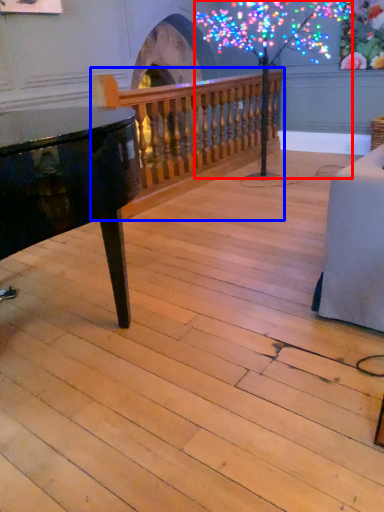
Question: Which of the following is the closest to the observer, tree (highlighted by a red box) or rail (highlighted by a blue box)?

Choices:
 (A) tree
 (B) rail

Answer: (A)